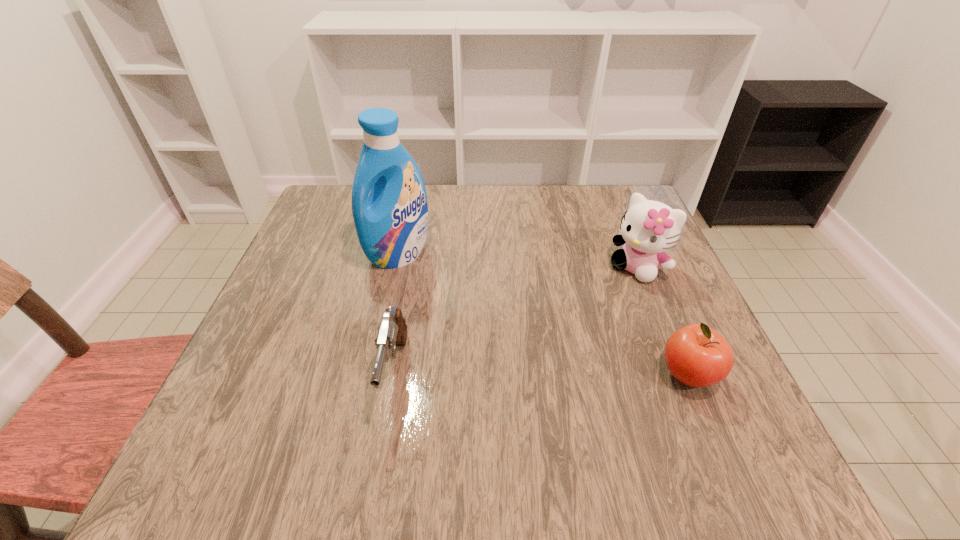
Where is `free space at the near right corner of the desktop`? free space at the near right corner of the desktop is located at coordinates (722, 403).

Locate an element on the screen. The image size is (960, 540). vacant space that's between the kitten and the tallest object is located at coordinates (518, 261).

Locate an element on the screen. Image resolution: width=960 pixels, height=540 pixels. free space between the kitten and the tallest object is located at coordinates (518, 261).

Identify the location of empty space between the kitten and the tallest object. (518, 261).

Locate an element on the screen. vacant space in between the apple and the pistol is located at coordinates (541, 373).

Locate an element on the screen. This screenshot has width=960, height=540. unoccupied position between the pistol and the third shortest object is located at coordinates (516, 320).

Locate an element on the screen. Image resolution: width=960 pixels, height=540 pixels. vacant area between the kitten and the tallest object is located at coordinates (518, 261).

Find the location of a particular element. This screenshot has width=960, height=540. vacant space that's between the apple and the third shortest object is located at coordinates (662, 321).

This screenshot has width=960, height=540. In order to click on vacant area between the second tallest object and the apple in this screenshot , I will do `click(662, 321)`.

Find the location of a particular element. The width and height of the screenshot is (960, 540). vacant area between the apple and the pistol is located at coordinates (541, 373).